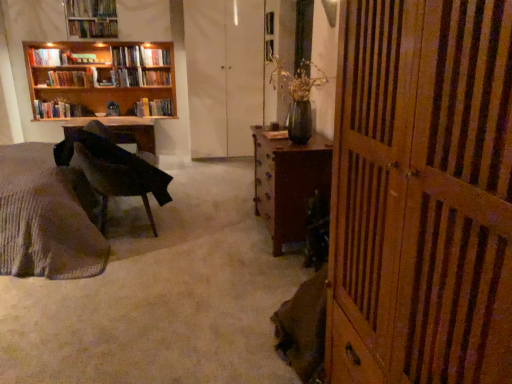
Question: From a real-world perspective, is hardcover book at upper left, acting as the 3th book starting from the bottom, physically located above or below hardcover book at upper left, which ranks as the 4th book in top-to-bottom order?

Choices:
 (A) above
 (B) below

Answer: (B)

Question: Considering their positions, is hardcover book at upper left, acting as the 3th book starting from the bottom, located in front of or behind hardcover book at upper left, which ranks as the 4th book in top-to-bottom order?

Choices:
 (A) behind
 (B) front

Answer: (B)

Question: Estimate the real-world distances between objects in this image. Which object is farther from the hardcover book at upper left, which is counted as the fifth book, starting from the top?

Choices:
 (A) hardcover book at upper left, which ranks as the 4th book in top-to-bottom order
 (B) wooden carved desk at center
 (C) white matte screen door at center, which ranks as the second screen door in right-to-left order
 (D) velvet dark brown chair at left
 (E) hardcover book at upper left, positioned as the second book in top-to-bottom order

Answer: (B)

Question: Which of these objects is positioned closest to the hardcover books at left, positioned as the sixth book in top-to-bottom order?

Choices:
 (A) velvet dark brown chair at left
 (B) hardcover books at left, acting as the seventh book starting from the top
 (C) wooden carved desk at center
 (D) hardcover book at upper left, the sixth book ordered from the bottom
 (E) wooden bookshelf at upper left

Answer: (B)